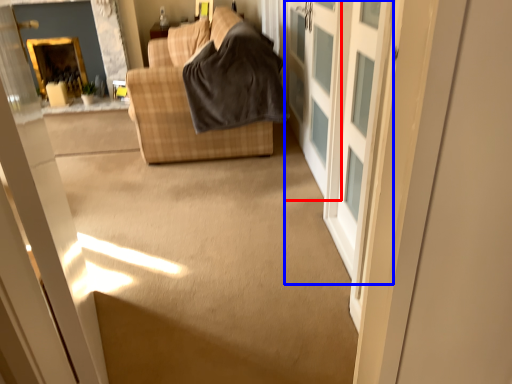
Question: Which point is closer to the camera, screen door (highlighted by a red box) or barn door (highlighted by a blue box)?

Choices:
 (A) screen door
 (B) barn door

Answer: (B)